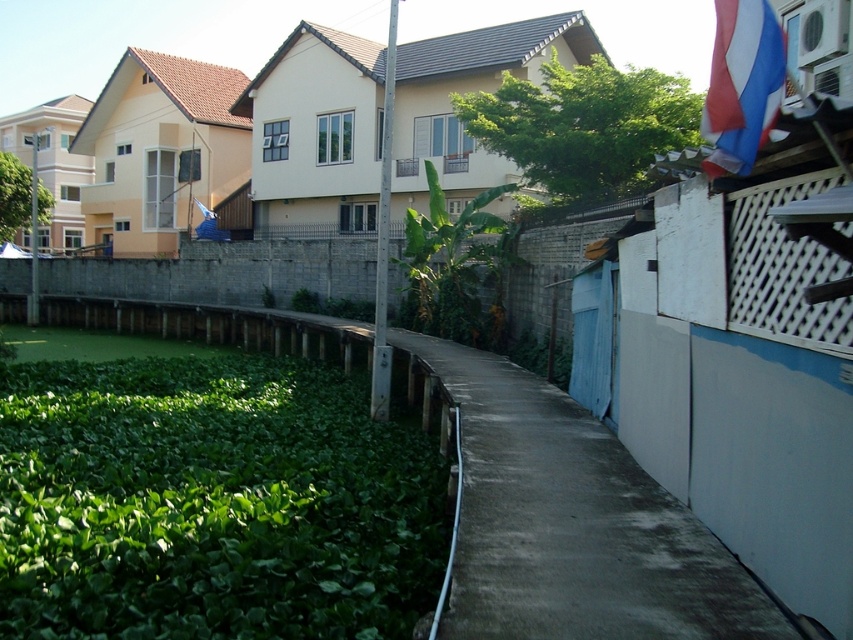
Which is in front, point (485, 356) or point (421, 221)?

Point (485, 356) is in front.

This screenshot has height=640, width=853. I want to click on green grass at lower left, so click(x=569, y=520).

The image size is (853, 640). What are the coordinates of `green grass at lower left` in the screenshot? It's located at (569, 520).

Between green leafy tree at upper center and green leafy vegetation at left, which one is positioned lower?

Positioned lower is green leafy tree at upper center.

Looking at this image, is green leafy tree at upper center wider than green leafy vegetation at left?

No, green leafy tree at upper center is not wider than green leafy vegetation at left.

You are a GUI agent. You are given a task and a screenshot of the screen. Output one action in this format:
    pyautogui.click(x=<x>, y=<y>)
    Task: Click on the green leafy tree at upper center
    
    Given the screenshot: What is the action you would take?
    (x=583, y=125)

Who is taller, green leafy algae at lower left or red fabric flag at upper right?

With more height is red fabric flag at upper right.

Who is shorter, green leafy algae at lower left or red fabric flag at upper right?

green leafy algae at lower left

Find the location of a particular element. green leafy algae at lower left is located at coordinates (212, 502).